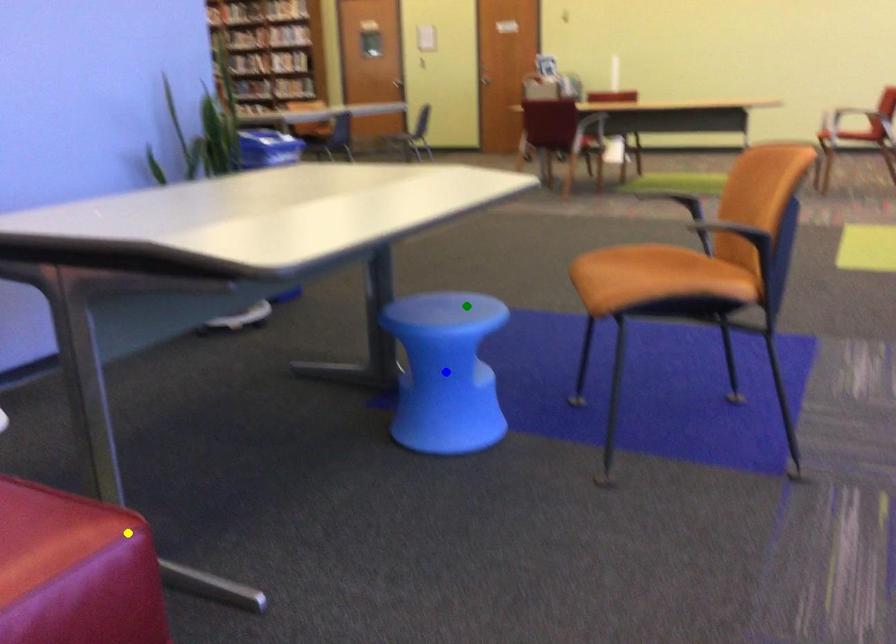
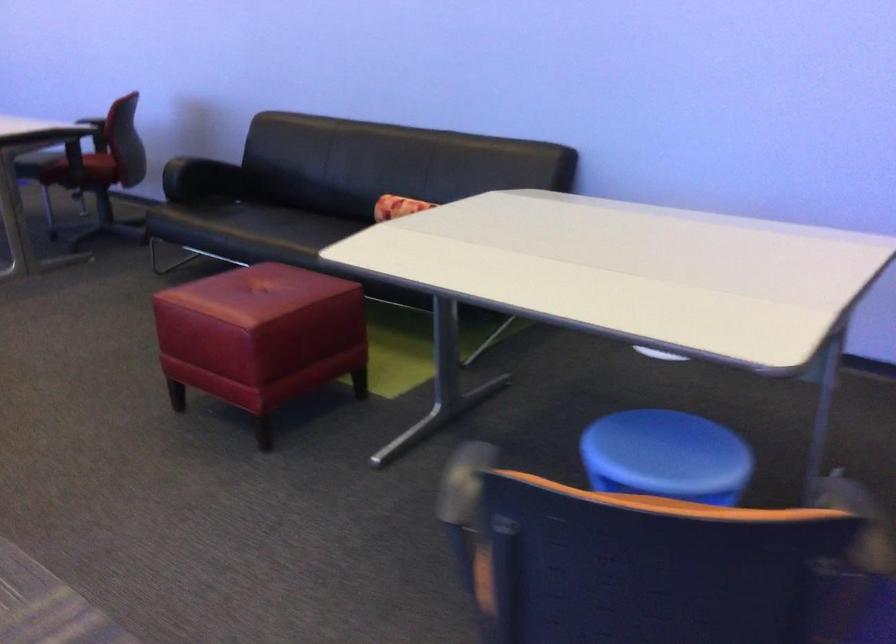
I am providing you with two images of the same scene from different viewpoints. Three points are marked in image1. Which point corresponds to a part or object that is occluded in image2?In image1, three points are marked. Which of them correspond to a part or object that is occluded in image2?Among the three points shown in image1, which one corresponds to a part or object that is no longer visible due to occlusion in image2?

Invisible in image2: blue point.